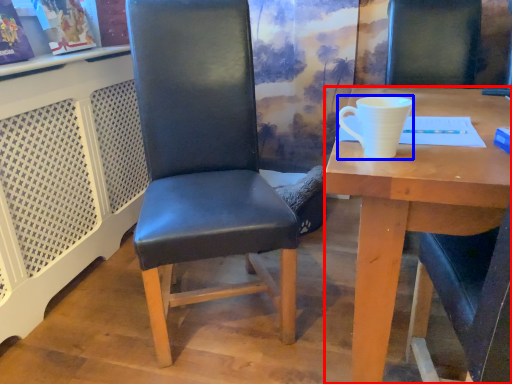
Question: Which object appears closest to the camera in this image, desk (highlighted by a red box) or coffee cup (highlighted by a blue box)?

Choices:
 (A) desk
 (B) coffee cup

Answer: (A)